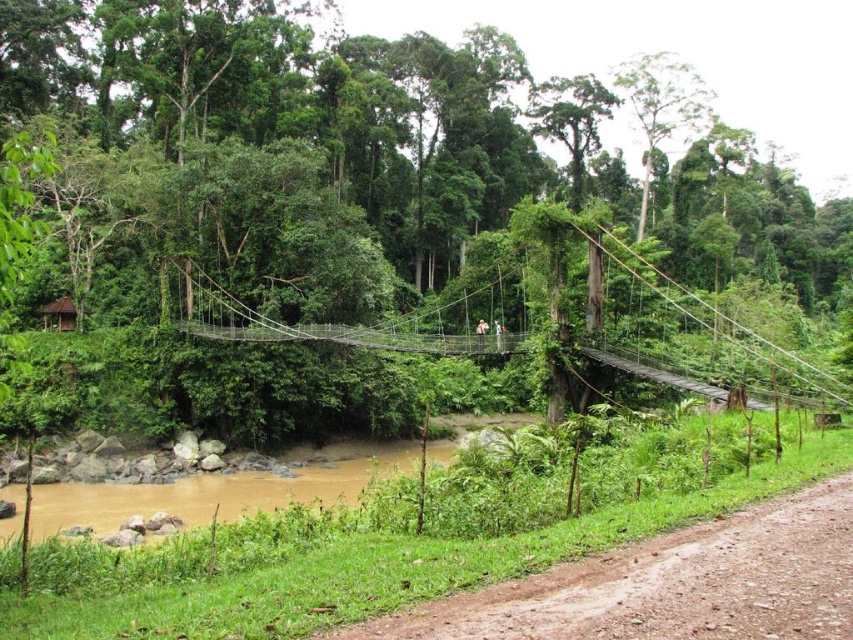
You are a hiker planning to cross the wire mesh bridge at center. You see the brown dirt track at lower right. Which path should you take first to reach the bridge?

You should take the brown dirt track at lower right first because it is closer to you than the wire mesh bridge at center, so you need to walk towards the bridge from there.

Consider the image. You are a hiker planning to cross the wire mesh bridge at center. From your current position on the brown dirt track at lower right, which direction should you move to reach the bridge?

The brown dirt track at lower right has a lesser height compared to the wire mesh bridge at center, so you should move upwards to reach the bridge.